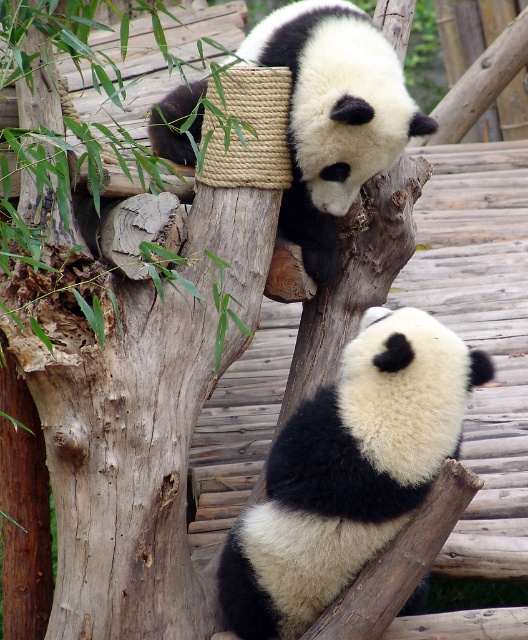
You are a zookeeper observing two pandas in their enclosure. You notice the black fuzzy panda at center and the black and white fur panda at upper center. Which panda is smaller in size?

The black fuzzy panda at center is smaller in size compared to the black and white fur panda at upper center.

You are a zookeeper trying to locate two pandas in their enclosure. You see two points marked as point 1 and point 2. Point 1 is at coordinates point (460,348) and point 2 is at point (194,96). Based on the scene description, which point is closer to you?

Point 1 is in front of point 2, so point 1 is closer to you.

You are a zookeeper observing the pandas in their enclosure. You notice the black fuzzy panda at center and the black and white fur panda at upper center. Which panda is located below the other?

The black fuzzy panda at center is positioned under the black and white fur panda at upper center, so the black fuzzy panda at center is below the other panda.